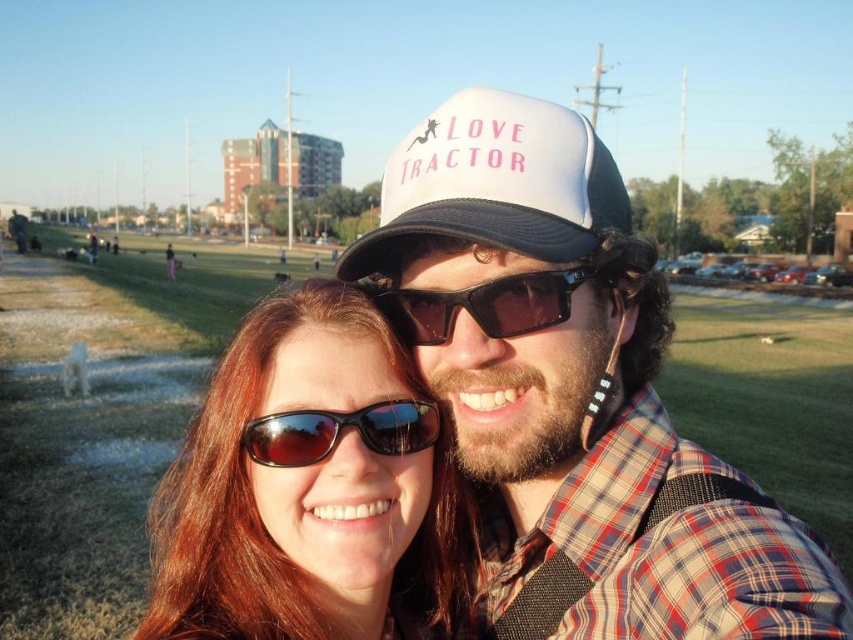
Find the location of a particular element. white matte baseball cap at center is located at coordinates (496, 182).

Which of these two, white matte baseball cap at center or black plastic sunglasses at center, stands shorter?

Standing shorter between the two is black plastic sunglasses at center.

Locate an element on the screen. white matte baseball cap at center is located at coordinates (496, 182).

Can you confirm if white mesh cap at center is thinner than shiny black sunglasses at center?

In fact, white mesh cap at center might be wider than shiny black sunglasses at center.

Can you confirm if white mesh cap at center is bigger than shiny black sunglasses at center?

Indeed, white mesh cap at center has a larger size compared to shiny black sunglasses at center.

The width and height of the screenshot is (853, 640). I want to click on white mesh cap at center, so click(x=573, y=392).

Identify the location of white mesh cap at center. (573, 392).

Is black plastic sunglasses at center below shiny black sunglasses at center?

Incorrect, black plastic sunglasses at center is not positioned below shiny black sunglasses at center.

What do you see at coordinates (482, 305) in the screenshot? I see `black plastic sunglasses at center` at bounding box center [482, 305].

Identify the location of black plastic sunglasses at center. (482, 305).

Identify the location of black plastic sunglasses at center. (482, 305).